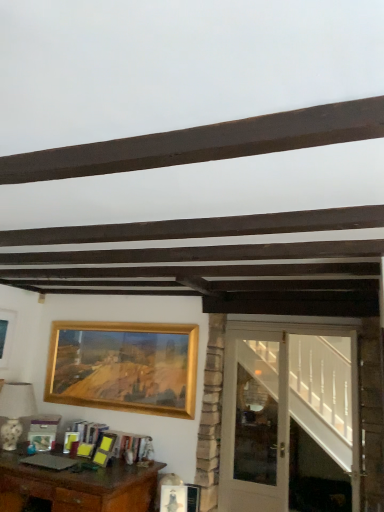
Question: Is white glass door at right not inside gold metallic picture frame at upper center, which is the 1th picture frame in right-to-left order?

Choices:
 (A) no
 (B) yes

Answer: (B)

Question: Is white glass door at right bigger than gold metallic picture frame at upper center, arranged as the 2th picture frame when viewed from the left?

Choices:
 (A) no
 (B) yes

Answer: (B)

Question: Is white glass door at right oriented away from gold metallic picture frame at upper center, arranged as the 2th picture frame when viewed from the left?

Choices:
 (A) no
 (B) yes

Answer: (A)

Question: Would you say gold metallic picture frame at upper center, which is the 1th picture frame in right-to-left order, is part of white glass door at right's contents?

Choices:
 (A) no
 (B) yes

Answer: (A)

Question: From the image's perspective, is white glass door at right below gold metallic picture frame at upper center, arranged as the 2th picture frame when viewed from the left?

Choices:
 (A) yes
 (B) no

Answer: (A)

Question: In terms of width, does brown wooden desk at lower left look wider or thinner when compared to gold metallic picture frame at upper center, arranged as the 2th picture frame when viewed from the left?

Choices:
 (A) thin
 (B) wide

Answer: (B)

Question: Is point (119, 465) closer or farther from the camera than point (71, 346)?

Choices:
 (A) farther
 (B) closer

Answer: (B)

Question: Is brown wooden desk at lower left situated inside gold metallic picture frame at upper center, arranged as the 2th picture frame when viewed from the left, or outside?

Choices:
 (A) inside
 (B) outside

Answer: (B)

Question: Considering their positions, is brown wooden desk at lower left located in front of or behind gold metallic picture frame at upper center, arranged as the 2th picture frame when viewed from the left?

Choices:
 (A) behind
 (B) front

Answer: (B)

Question: Would you say white glossy lampshade at left is to the left or to the right of brown wooden desk at lower left in the picture?

Choices:
 (A) right
 (B) left

Answer: (B)

Question: From the image's perspective, relative to brown wooden desk at lower left, is white glossy lampshade at left above or below?

Choices:
 (A) above
 (B) below

Answer: (A)

Question: Is white glossy lampshade at left wider or thinner than brown wooden desk at lower left?

Choices:
 (A) wide
 (B) thin

Answer: (B)

Question: From a real-world perspective, is white glossy lampshade at left positioned above or below brown wooden desk at lower left?

Choices:
 (A) below
 (B) above

Answer: (B)

Question: Is brown wooden desk at lower left wider or thinner than gold metallic picture frame at upper left, the second picture frame in the right-to-left sequence?

Choices:
 (A) wide
 (B) thin

Answer: (A)

Question: Considering the positions of brown wooden desk at lower left and gold metallic picture frame at upper left, the second picture frame in the right-to-left sequence, in the image, is brown wooden desk at lower left taller or shorter than gold metallic picture frame at upper left, the second picture frame in the right-to-left sequence,?

Choices:
 (A) tall
 (B) short

Answer: (A)